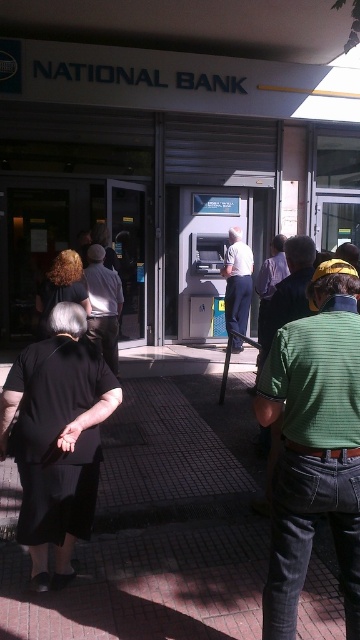
You are a delivery person who needs to quickly deliver a package to the bank manager inside the National Bank. You see the metal atm at center and the green striped shirt at center. Which object is bigger and can help you determine the correct entrance to the bank?

The metal atm at center has a larger size compared to green striped shirt at center. Since the ATM is larger, it might be positioned near the main entrance, helping you locate the correct entrance to the National Bank.

You are standing at the entrance of the National Bank and see a person in a green striped shirt at center and dark gray pants at center. Which clothing item is nearer to you?

The green striped shirt at center is closer to the viewer than dark gray pants at center.